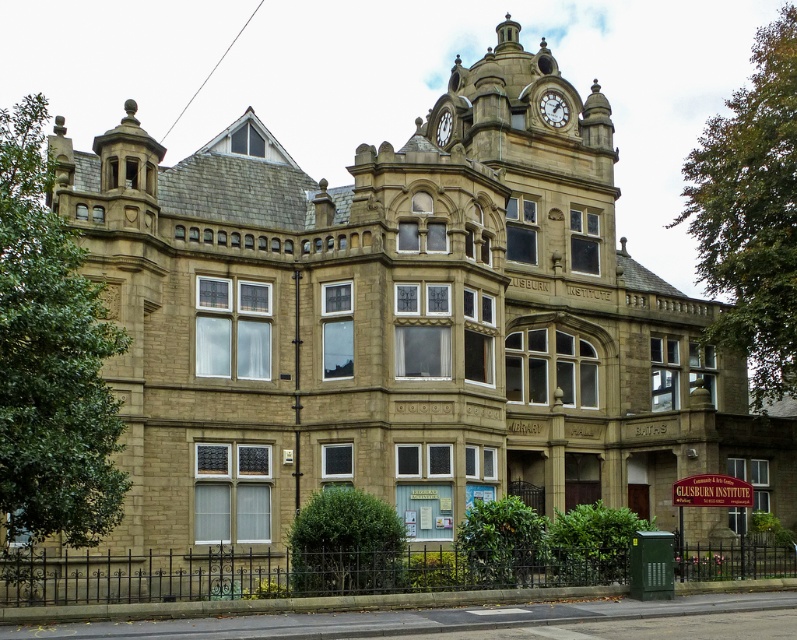
Question: Can you confirm if gold textured clock at upper center is smaller than gold metallic clock at upper center?

Choices:
 (A) yes
 (B) no

Answer: (B)

Question: Which object appears farthest from the camera in this image?

Choices:
 (A) gold metallic clock at upper center
 (B) gold textured clock at upper center

Answer: (A)

Question: Can you confirm if gold textured clock at upper center is bigger than gold metallic clock at upper center?

Choices:
 (A) yes
 (B) no

Answer: (A)

Question: Which object appears farthest from the camera in this image?

Choices:
 (A) gold textured clock at upper center
 (B) gold metallic clock at upper center

Answer: (B)

Question: Can you confirm if gold textured clock at upper center is positioned above gold metallic clock at upper center?

Choices:
 (A) yes
 (B) no

Answer: (A)